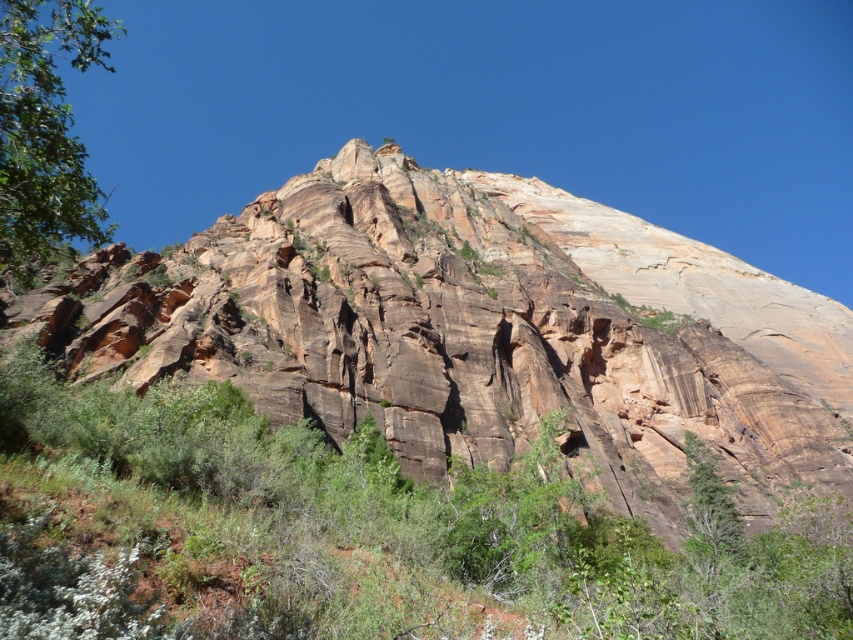
Question: In this image, where is rustic rock cliff at center located relative to green leafy tree at left?

Choices:
 (A) right
 (B) left

Answer: (A)

Question: Among these points, which one is nearest to the camera?

Choices:
 (A) (265, 541)
 (B) (57, 243)

Answer: (A)

Question: Can you confirm if rustic rock cliff at center is thinner than green leafy tree at left?

Choices:
 (A) yes
 (B) no

Answer: (A)

Question: Estimate the real-world distances between objects in this image. Which object is farther from the rustic rock cliff at center?

Choices:
 (A) green leafy tree at left
 (B) green leafy shrubs at center

Answer: (A)

Question: Is rustic rock cliff at center above green leafy tree at left?

Choices:
 (A) yes
 (B) no

Answer: (B)

Question: Which of the following is the closest to the observer?

Choices:
 (A) (630, 307)
 (B) (62, 205)
 (C) (178, 413)

Answer: (B)